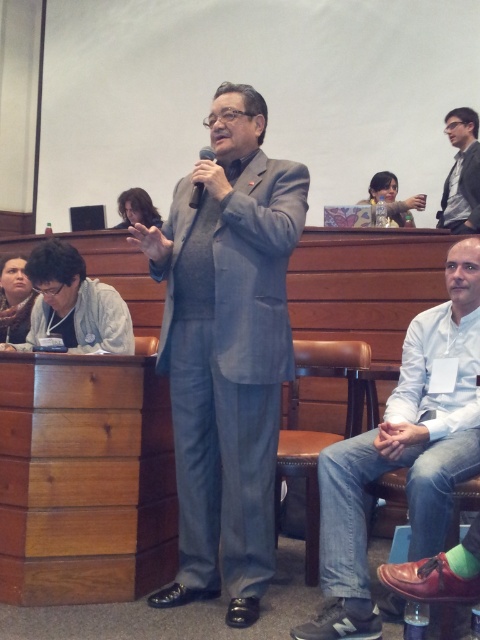
Who is lower down, gray fabric suit at center or white cotton shirt at lower right?

white cotton shirt at lower right is below.

Is point (298, 228) positioned in front of point (460, 300)?

Yes, point (298, 228) is closer to viewer.

Is point (194, 170) positioned after point (332, 451)?

Yes.

Find the location of a particular element. gray fabric suit at center is located at coordinates (227, 349).

Who is positioned more to the left, white cotton shirt at lower right or matte black suit at upper right?

white cotton shirt at lower right is more to the left.

Which is in front, point (335, 531) or point (451, 227)?

Point (335, 531) is more forward.

Between point (465, 316) and point (444, 196), which one is positioned behind?

Positioned behind is point (444, 196).

This screenshot has height=640, width=480. In order to click on white cotton shirt at lower right in this screenshot , I will do [404, 452].

Does gray fabric suit at center appear on the left side of black matte microphone at center?

In fact, gray fabric suit at center is to the right of black matte microphone at center.

Who is more forward, (208, 593) or (192, 198)?

Point (192, 198) is more forward.

Where is `gray fabric suit at center`? The image size is (480, 640). gray fabric suit at center is located at coordinates (227, 349).